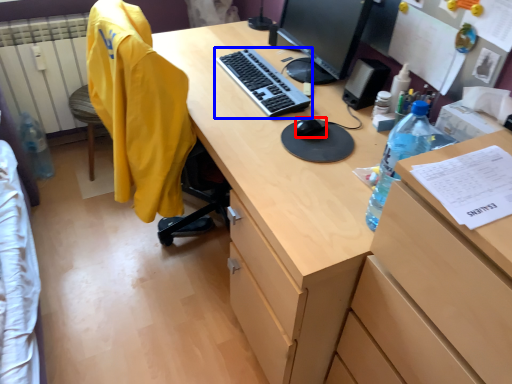
Question: Which point is further to the camera, mouse (highlighted by a red box) or computer keyboard (highlighted by a blue box)?

Choices:
 (A) mouse
 (B) computer keyboard

Answer: (B)